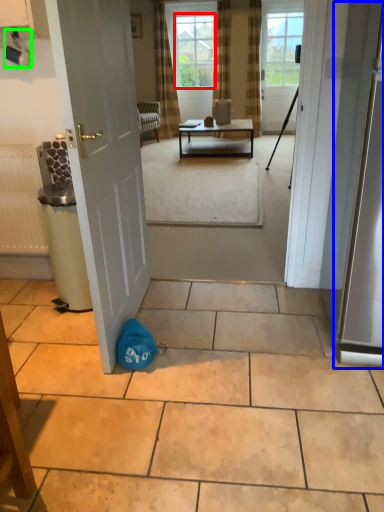
Question: Considering the real-world distances, which object is closest to window screen (highlighted by a red box)? screen door (highlighted by a blue box) or coffee cup (highlighted by a green box).

Choices:
 (A) screen door
 (B) coffee cup

Answer: (B)